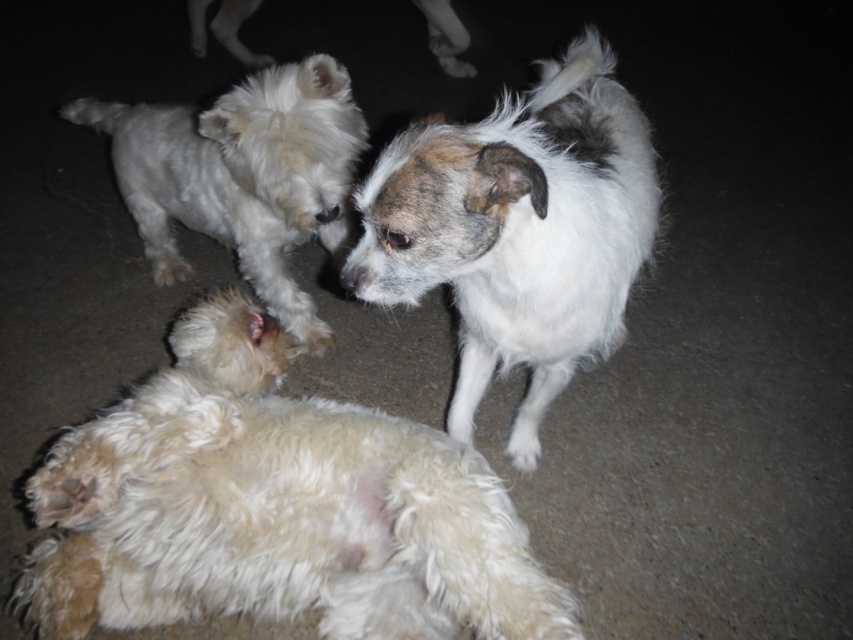
Question: Which object appears farthest from the camera in this image?

Choices:
 (A) fluffy white dog at lower left
 (B) white fluffy dog at upper left

Answer: (B)

Question: Does fluffy white dog at lower left come behind white fluffy dog at center?

Choices:
 (A) yes
 (B) no

Answer: (A)

Question: Can you confirm if fluffy white dog at lower left is positioned to the right of white fluffy dog at center?

Choices:
 (A) no
 (B) yes

Answer: (A)

Question: Is fluffy white dog at lower left positioned in front of white fluffy dog at center?

Choices:
 (A) yes
 (B) no

Answer: (B)

Question: Based on their relative distances, which object is nearer to the fluffy white dog at lower left?

Choices:
 (A) white fluffy dog at center
 (B) white fluffy dog at upper left

Answer: (A)

Question: Among these objects, which one is farthest from the camera?

Choices:
 (A) white fluffy dog at upper left
 (B) fluffy white dog at lower left

Answer: (A)